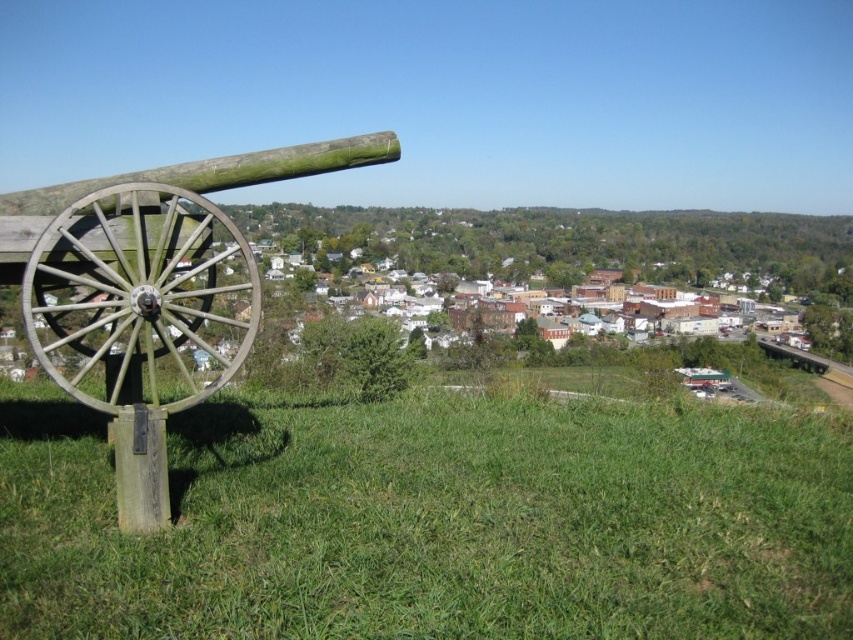
Question: Is the position of green grassy field at lower left more distant than that of green wood cannon at left?

Choices:
 (A) no
 (B) yes

Answer: (B)

Question: Is green grassy field at lower left positioned behind green wood cannon at left?

Choices:
 (A) yes
 (B) no

Answer: (A)

Question: Which object appears farthest from the camera in this image?

Choices:
 (A) green grassy field at lower left
 (B) green wood cannon at left

Answer: (A)

Question: Which of the following is the closest to the observer?

Choices:
 (A) (64, 342)
 (B) (33, 397)

Answer: (A)

Question: Is green grassy field at lower left thinner than green wood cannon at left?

Choices:
 (A) yes
 (B) no

Answer: (B)